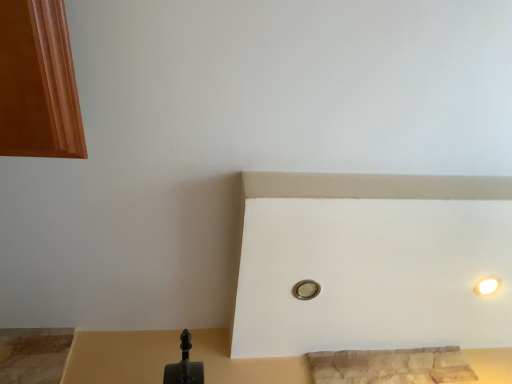
Describe the element at coordinates (121, 356) in the screenshot. I see `matte brown table at lower center` at that location.

Find the location of a particular element. The width and height of the screenshot is (512, 384). matte brown table at lower center is located at coordinates (121, 356).

Where is `matte brown table at lower center`? matte brown table at lower center is located at coordinates (121, 356).